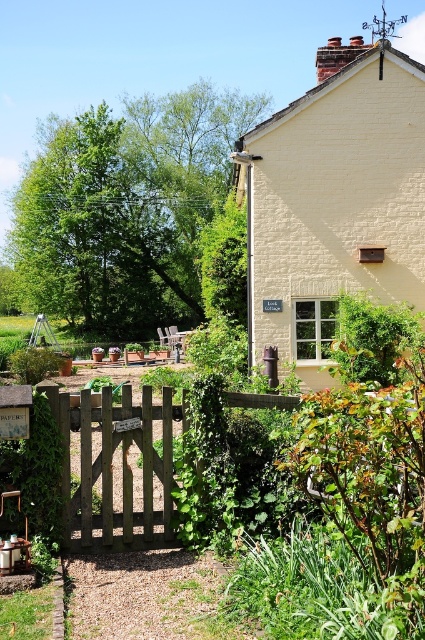
Does yellow brick cottage at upper center have a lesser width compared to brown wooden gate at center?

In fact, yellow brick cottage at upper center might be wider than brown wooden gate at center.

Describe the element at coordinates (334, 202) in the screenshot. I see `yellow brick cottage at upper center` at that location.

Locate an element on the screen. This screenshot has width=425, height=640. yellow brick cottage at upper center is located at coordinates (334, 202).

At what (x,y) coordinates should I click in order to perform the action: click on yellow brick cottage at upper center. Please return your answer as a coordinate pair (x, y). This screenshot has height=640, width=425. Looking at the image, I should click on (334, 202).